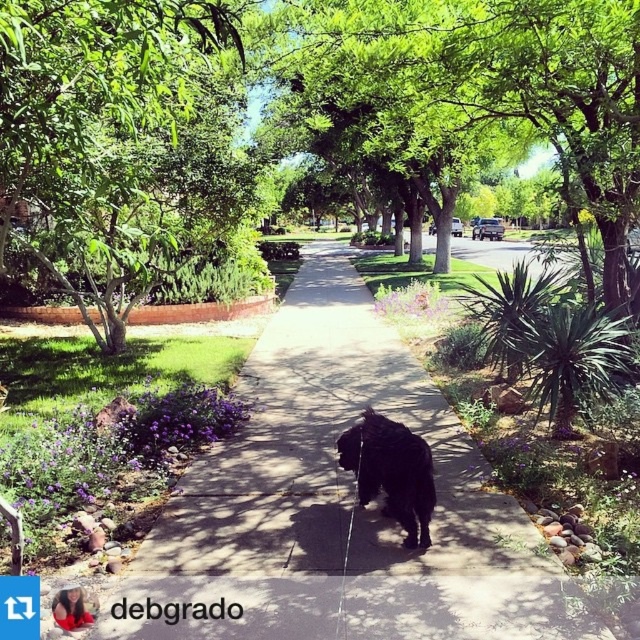
Can you confirm if green leafy tree at center is wider than green leafy tree at upper left?

Yes, green leafy tree at center is wider than green leafy tree at upper left.

Who is taller, green leafy tree at center or green leafy tree at upper left?

Standing taller between the two is green leafy tree at center.

Which is behind, point (355, 51) or point (189, 221)?

Point (189, 221)

Locate an element on the screen. green leafy tree at center is located at coordinates (467, 96).

Is smooth concrete sidewalk at center wider than green leafy tree at upper left?

Yes, smooth concrete sidewalk at center is wider than green leafy tree at upper left.

Between smooth concrete sidewalk at center and green leafy tree at upper left, which one is positioned higher?

Positioned higher is green leafy tree at upper left.

Does point (369, 522) come closer to viewer compared to point (54, 58)?

No, it is not.

The width and height of the screenshot is (640, 640). Find the location of `smooth concrete sidewalk at center`. smooth concrete sidewalk at center is located at coordinates (340, 502).

Does smooth concrete sidewalk at center appear on the right side of green leafy tree at center?

No, smooth concrete sidewalk at center is not to the right of green leafy tree at center.

Does smooth concrete sidewalk at center have a larger size compared to green leafy tree at center?

No.

The width and height of the screenshot is (640, 640). In order to click on smooth concrete sidewalk at center in this screenshot , I will do `click(340, 502)`.

The width and height of the screenshot is (640, 640). In order to click on smooth concrete sidewalk at center in this screenshot , I will do `click(340, 502)`.